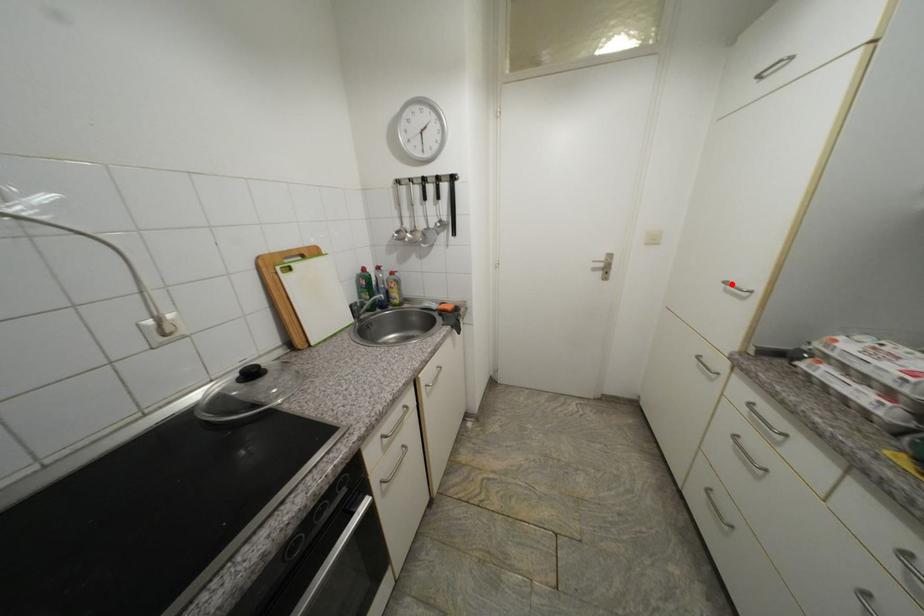
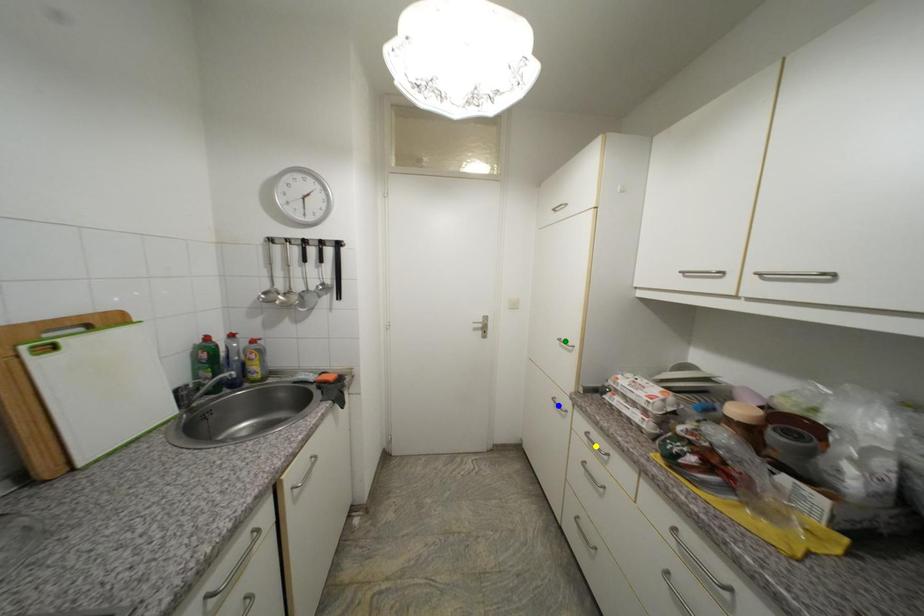
Question: I am providing you with two images of the same scene from different viewpoints. A red point is marked on the first image. You are given multiple points on the second image. Which spot in image 2 lines up with the point in image 1?

Choices:
 (A) green point
 (B) blue point
 (C) yellow point

Answer: (A)